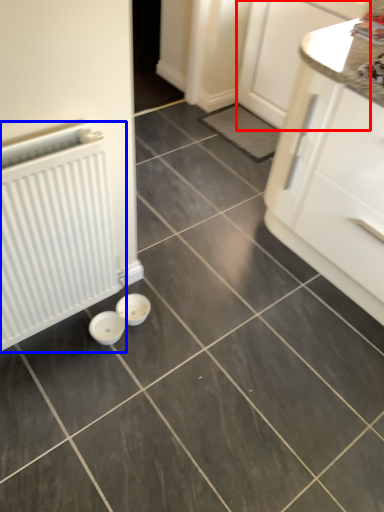
Question: Which of the following is the farthest to the observer, cabinetry (highlighted by a red box) or radiator (highlighted by a blue box)?

Choices:
 (A) cabinetry
 (B) radiator

Answer: (A)